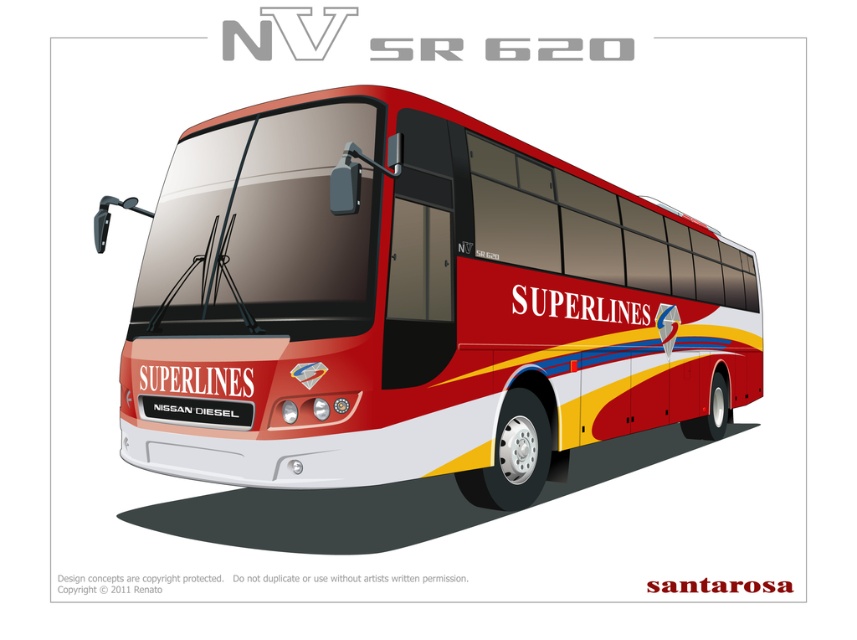
Who is higher up, shiny red bus at center or matte black license plate at front?

shiny red bus at center is above.

How much distance is there between shiny red bus at center and matte black license plate at front?

9.12 feet

What do you see at coordinates (423, 305) in the screenshot? The width and height of the screenshot is (857, 640). I see `shiny red bus at center` at bounding box center [423, 305].

In order to click on shiny red bus at center in this screenshot , I will do `click(423, 305)`.